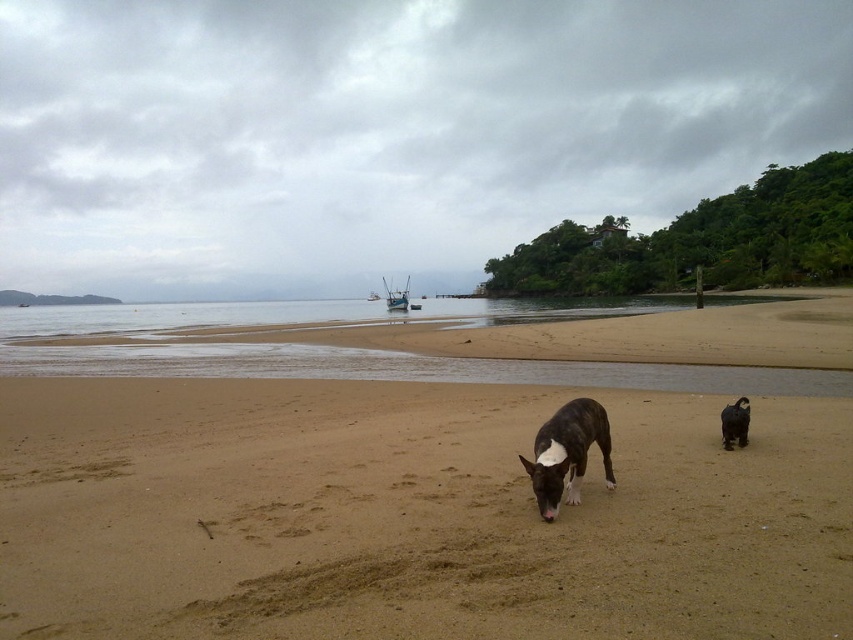
Question: Does white glossy dog at center have a larger size compared to brown fur dog at center?

Choices:
 (A) no
 (B) yes

Answer: (B)

Question: Which point is farther to the camera?

Choices:
 (A) (403, 296)
 (B) (39, 541)

Answer: (A)

Question: In this image, where is brown sandy beach at center located relative to white glossy dog at center?

Choices:
 (A) right
 (B) left

Answer: (B)

Question: Estimate the real-world distances between objects in this image. Which object is farther from the brown fur dog at center?

Choices:
 (A) white glossy dog at center
 (B) blue wooden boat at center
 (C) brown sandy beach at center

Answer: (B)

Question: Which is nearer to the blue wooden boat at center?

Choices:
 (A) brown fur dog at center
 (B) brown sandy beach at center
 (C) white glossy dog at center

Answer: (B)

Question: Can you confirm if brown fur dog at center is smaller than blue wooden boat at center?

Choices:
 (A) yes
 (B) no

Answer: (A)